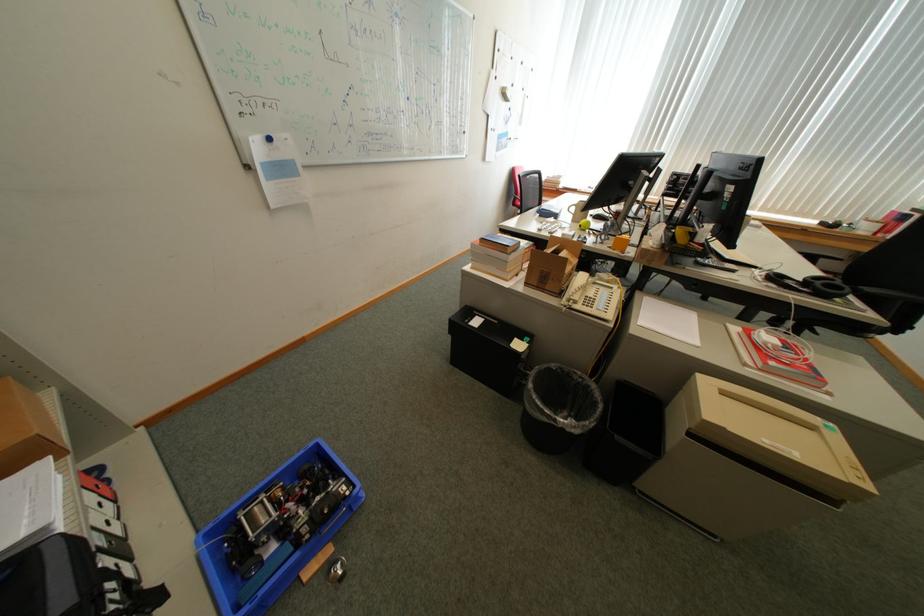
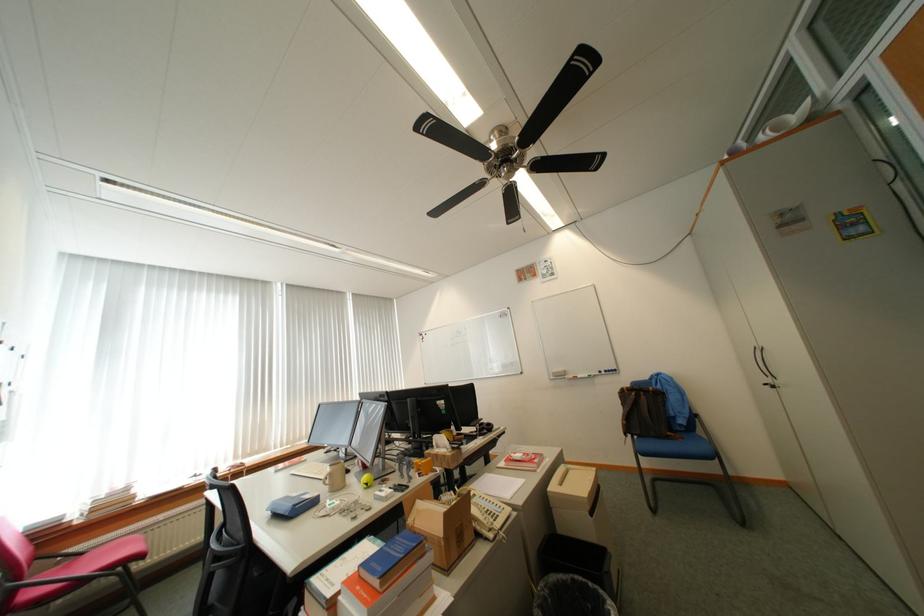
In the second image, find the point that corresponds to (581,211) in the first image.

(336, 482)